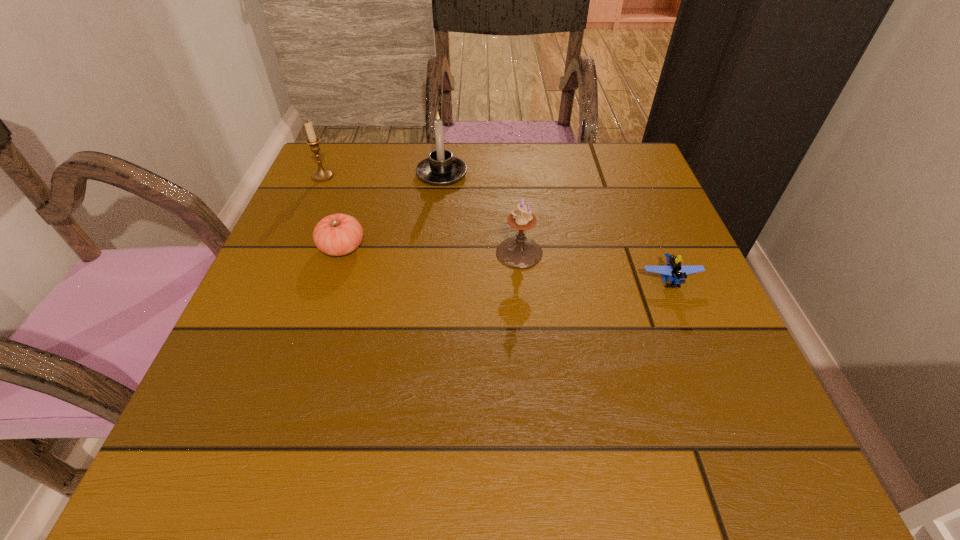
Where is `free location located 0.050m on the front-facing side of the rightmost object`? The height and width of the screenshot is (540, 960). free location located 0.050m on the front-facing side of the rightmost object is located at coordinates (686, 320).

Where is `candle holder that is at the left edge`? This screenshot has width=960, height=540. candle holder that is at the left edge is located at coordinates (321, 175).

Image resolution: width=960 pixels, height=540 pixels. What are the coordinates of `tomato positioned at the left edge` in the screenshot? It's located at (339, 234).

Identify the location of object present at the right edge. The width and height of the screenshot is (960, 540). (676, 273).

You are a GUI agent. You are given a task and a screenshot of the screen. Output one action in this format:
    pyautogui.click(x=<x>, y=<y>)
    Task: Click on the object that is at the far left corner
    The height and width of the screenshot is (540, 960).
    Given the screenshot: What is the action you would take?
    pyautogui.click(x=321, y=175)

In the image, there is a desktop. Identify the location of vacant space at the far edge. (x=517, y=191).

Where is `vacant space at the near edge of the desktop`? This screenshot has height=540, width=960. vacant space at the near edge of the desktop is located at coordinates (658, 475).

The image size is (960, 540). Find the location of `vacant region at the left edge`. vacant region at the left edge is located at coordinates (276, 400).

Where is `free space at the right edge`? The image size is (960, 540). free space at the right edge is located at coordinates (608, 199).

Where is `vacant area at the far left corner of the desktop`? The image size is (960, 540). vacant area at the far left corner of the desktop is located at coordinates (336, 166).